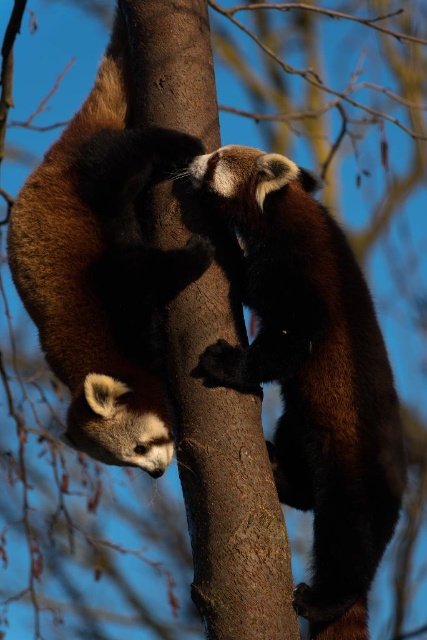
Is brown furry panda at center shorter than brown furry panda at left?

In fact, brown furry panda at center may be taller than brown furry panda at left.

Which is behind, point (371, 337) or point (136, 285)?

Positioned behind is point (371, 337).

Identify the location of brown furry panda at center. This screenshot has height=640, width=427. (312, 374).